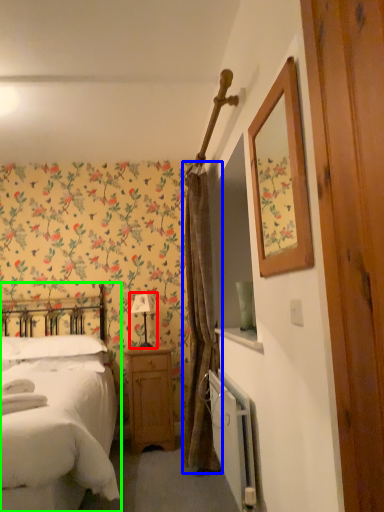
Question: Which is farther away from table lamp (highlighted by a red box)? curtain (highlighted by a blue box) or bed (highlighted by a green box)?

Choices:
 (A) curtain
 (B) bed

Answer: (B)